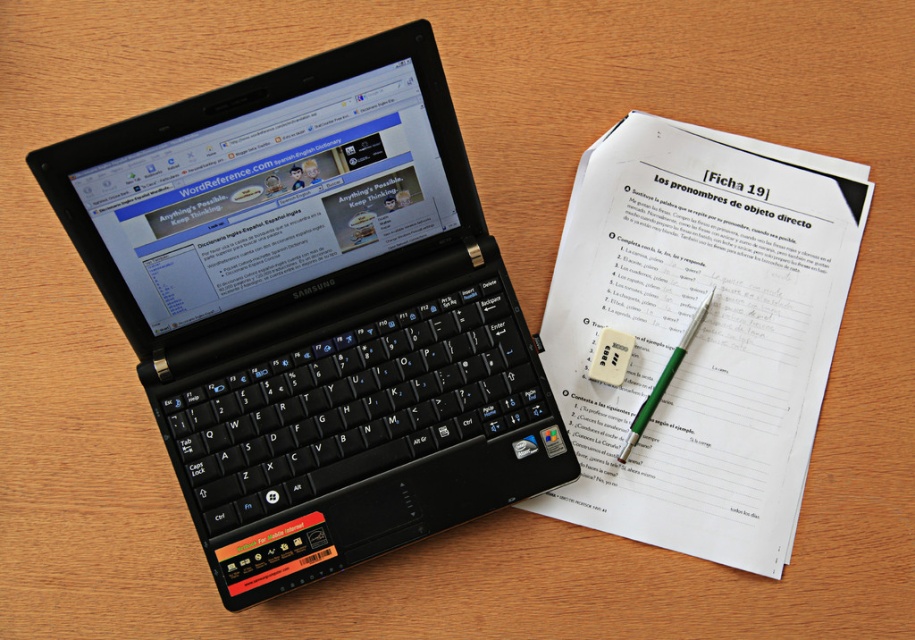
Question: Does black plastic laptop at upper left have a larger size compared to black plastic keyboard at center?

Choices:
 (A) no
 (B) yes

Answer: (B)

Question: Is black plastic laptop at upper left below white paper at upper right?

Choices:
 (A) yes
 (B) no

Answer: (B)

Question: Which of these objects is positioned farthest from the black plastic laptop at upper left?

Choices:
 (A) white paper at upper right
 (B) black plastic keyboard at center

Answer: (A)

Question: Does white paper at upper right appear on the left side of black plastic keyboard at center?

Choices:
 (A) yes
 (B) no

Answer: (B)

Question: Which point is closer to the camera?

Choices:
 (A) black plastic laptop at upper left
 (B) green plastic pen at upper right
 (C) white paper at upper right
 (D) black plastic keyboard at center

Answer: (A)

Question: Among these points, which one is nearest to the camera?

Choices:
 (A) (687, 337)
 (B) (562, 308)
 (C) (483, 339)

Answer: (C)